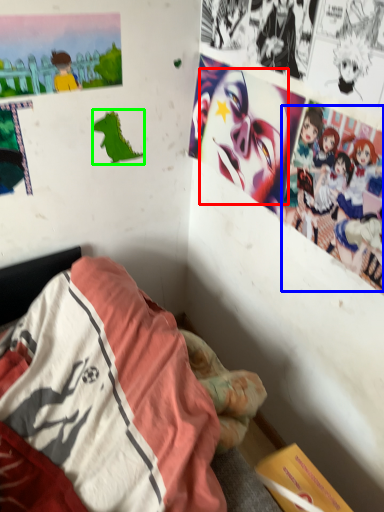
Question: Based on their relative distances, which object is nearer to human face (highlighted by a red box)? Choose from person (highlighted by a blue box) and art (highlighted by a green box).

Choices:
 (A) person
 (B) art

Answer: (A)